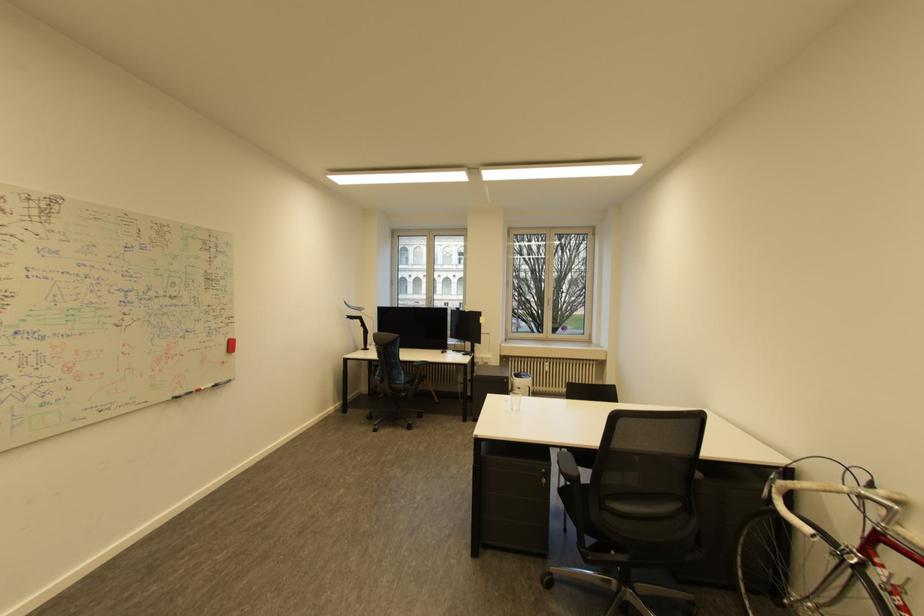
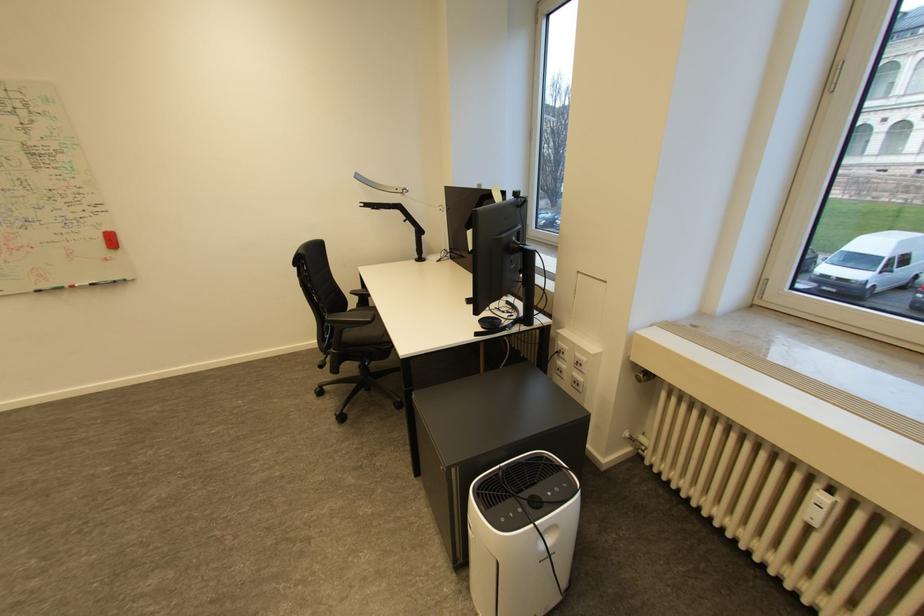
Locate, in the second image, the point that corresponds to (210,389) in the first image.

(83, 286)